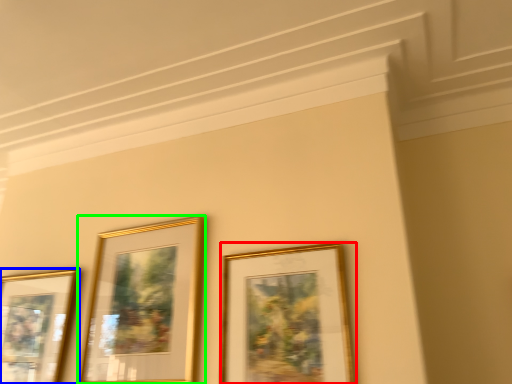
Question: Which is nearer to the picture frame (highlighted by a red box)? picture frame (highlighted by a blue box) or picture frame (highlighted by a green box).

Choices:
 (A) picture frame
 (B) picture frame

Answer: (B)